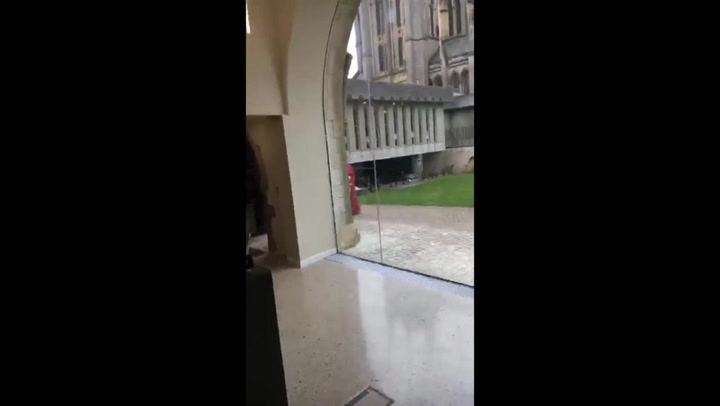
Locate an element on the screen. The width and height of the screenshot is (720, 406). arched doorway is located at coordinates (318, 36).